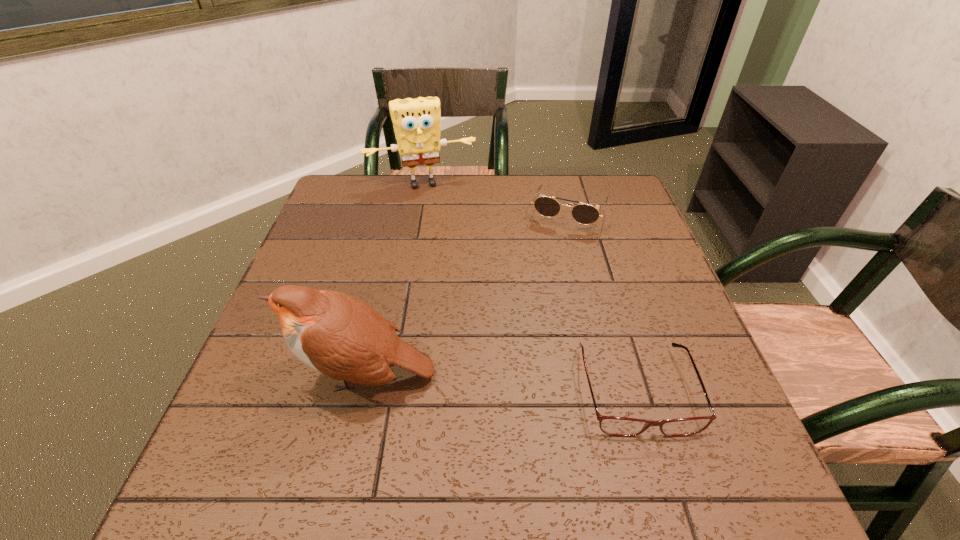
Identify the location of bird. The image size is (960, 540). (339, 335).

The height and width of the screenshot is (540, 960). I want to click on the shortest object, so click(616, 426).

Find the location of a particular element. The height and width of the screenshot is (540, 960). sunglasses is located at coordinates (585, 214).

I want to click on sponge, so click(416, 122).

Where is `vacant space located 0.060m at the face of the bird`? vacant space located 0.060m at the face of the bird is located at coordinates (263, 375).

The image size is (960, 540). What are the coordinates of `free location located at the face of the bird` in the screenshot? It's located at (243, 375).

Locate an element on the screen. The width and height of the screenshot is (960, 540). free space located 0.240m on the front lenses of the sunglasses is located at coordinates [x=538, y=294].

Locate an element on the screen. The height and width of the screenshot is (540, 960). free space located on the front lenses of the sunglasses is located at coordinates (521, 338).

The image size is (960, 540). I want to click on free region located on the front lenses of the sunglasses, so click(x=543, y=278).

Image resolution: width=960 pixels, height=540 pixels. What are the coordinates of `vacant space located on the face of the sponge` in the screenshot? It's located at (439, 212).